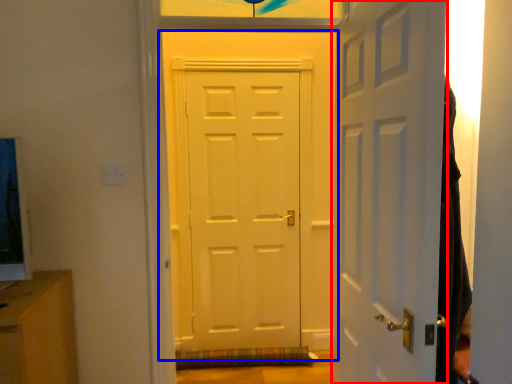
Question: Which object is closer to the camera taking this photo, door (highlighted by a red box) or door (highlighted by a blue box)?

Choices:
 (A) door
 (B) door

Answer: (A)